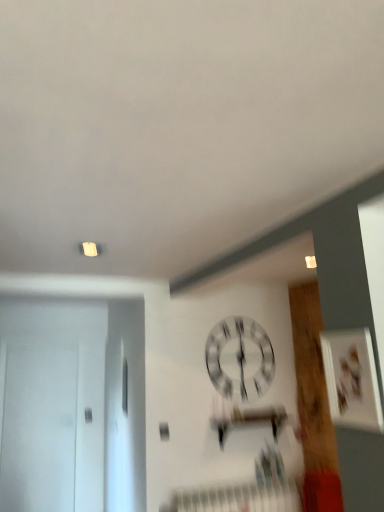
Question: Is white glossy clock at center bigger or smaller than white matte door at left?

Choices:
 (A) small
 (B) big

Answer: (A)

Question: Is white glossy clock at center in front of or behind white matte door at left in the image?

Choices:
 (A) behind
 (B) front

Answer: (B)

Question: Is point (244, 373) closer or farther from the camera than point (56, 431)?

Choices:
 (A) closer
 (B) farther

Answer: (A)

Question: From a real-world perspective, is white matte door at left positioned above or below white glossy clock at center?

Choices:
 (A) above
 (B) below

Answer: (B)

Question: From the image's perspective, is white matte door at left positioned above or below white glossy clock at center?

Choices:
 (A) above
 (B) below

Answer: (B)

Question: Which is correct: white matte door at left is inside white glossy clock at center, or outside of it?

Choices:
 (A) outside
 (B) inside

Answer: (A)

Question: From their relative heights in the image, would you say white matte door at left is taller or shorter than white glossy clock at center?

Choices:
 (A) tall
 (B) short

Answer: (A)